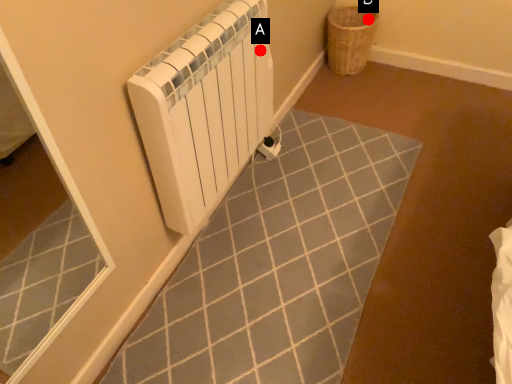
Question: Two points are circled on the image, labeled by A and B beside each circle. Which point is farther from the camera taking this photo?

Choices:
 (A) A is further
 (B) B is further

Answer: (B)